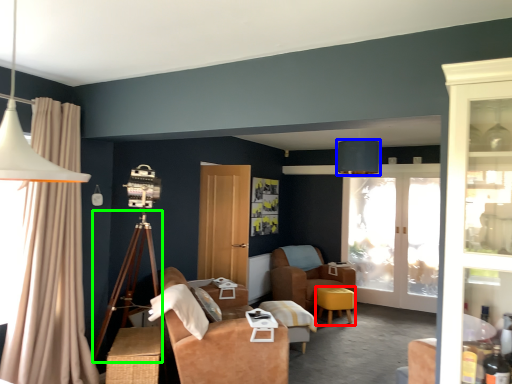
Question: Which is farther away from stool (highlighted by a red box)? table lamp (highlighted by a blue box) or tripod (highlighted by a green box)?

Choices:
 (A) table lamp
 (B) tripod

Answer: (B)